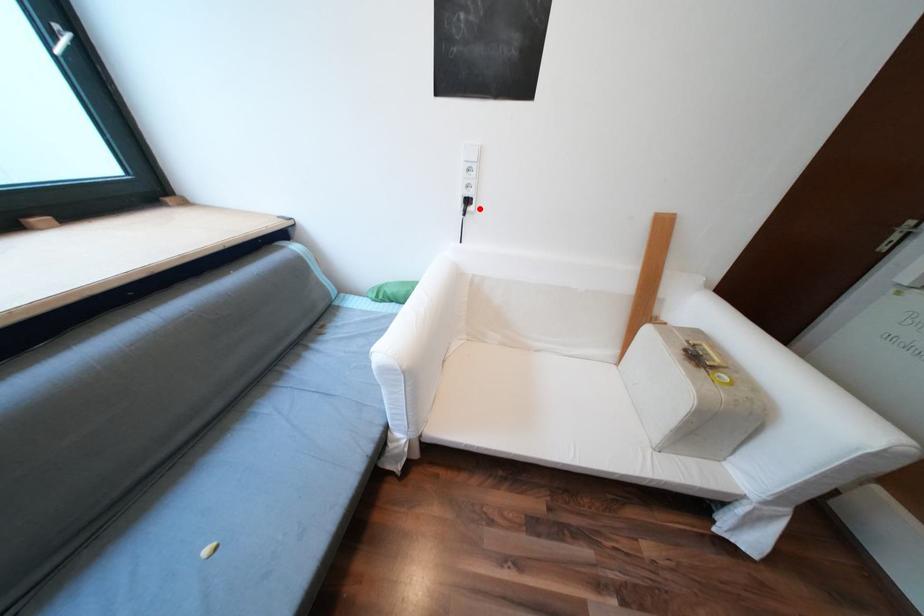
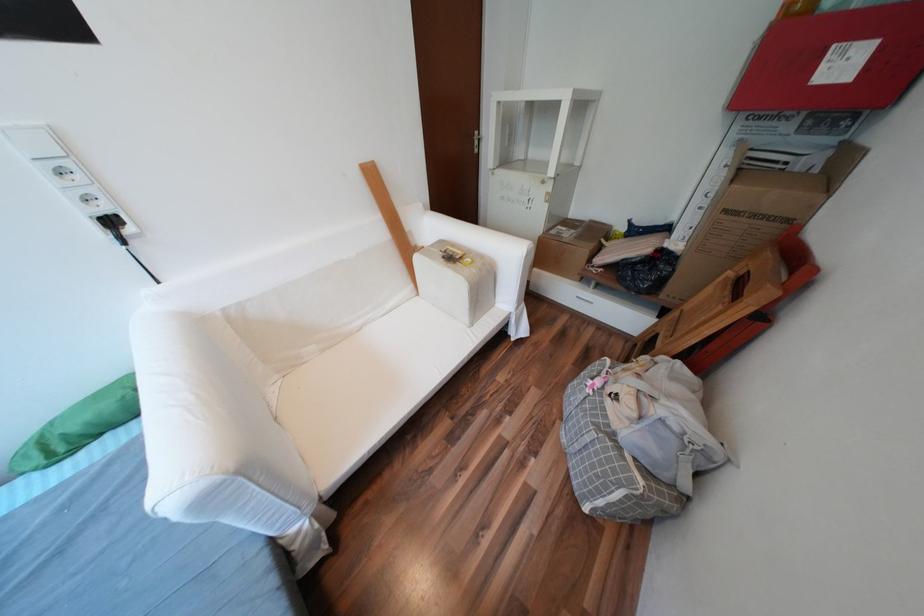
The point at the highlighted location is marked in the first image. Where is the corresponding point in the second image?

(138, 231)